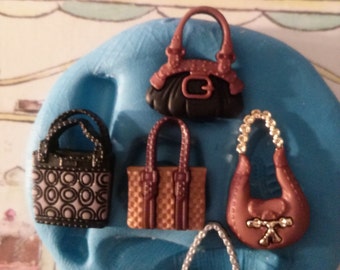
This screenshot has height=270, width=340. What are the coordinates of `toy box` in the screenshot? It's located at (36, 54).